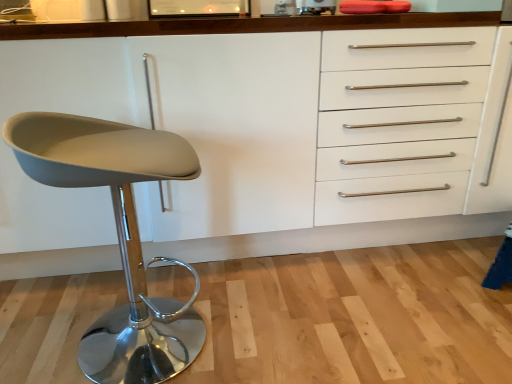
Question: From the image's perspective, is matte gray seat at left above or below white wood cabinet at center?

Choices:
 (A) above
 (B) below

Answer: (B)

Question: Is matte gray seat at left wider or thinner than white wood cabinet at center?

Choices:
 (A) wide
 (B) thin

Answer: (B)

Question: From their relative heights in the image, would you say matte gray seat at left is taller or shorter than white wood cabinet at center?

Choices:
 (A) tall
 (B) short

Answer: (B)

Question: Would you say white wood cabinet at center is to the left or to the right of matte gray seat at left in the picture?

Choices:
 (A) right
 (B) left

Answer: (A)

Question: From the image's perspective, relative to matte gray seat at left, is white wood cabinet at center above or below?

Choices:
 (A) above
 (B) below

Answer: (A)

Question: Is white wood cabinet at center in front of or behind matte gray seat at left in the image?

Choices:
 (A) behind
 (B) front

Answer: (A)

Question: Does point (481, 79) appear closer or farther from the camera than point (115, 347)?

Choices:
 (A) farther
 (B) closer

Answer: (A)